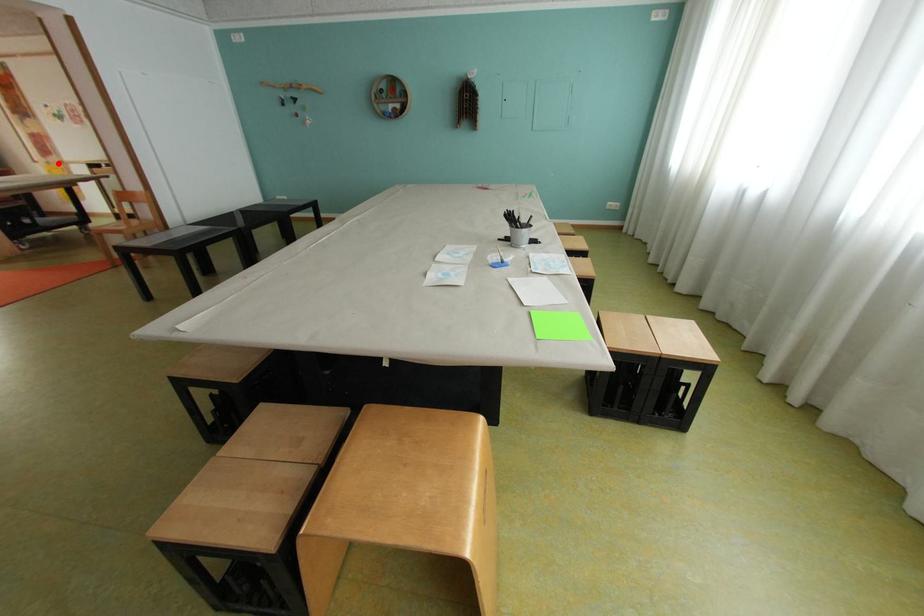
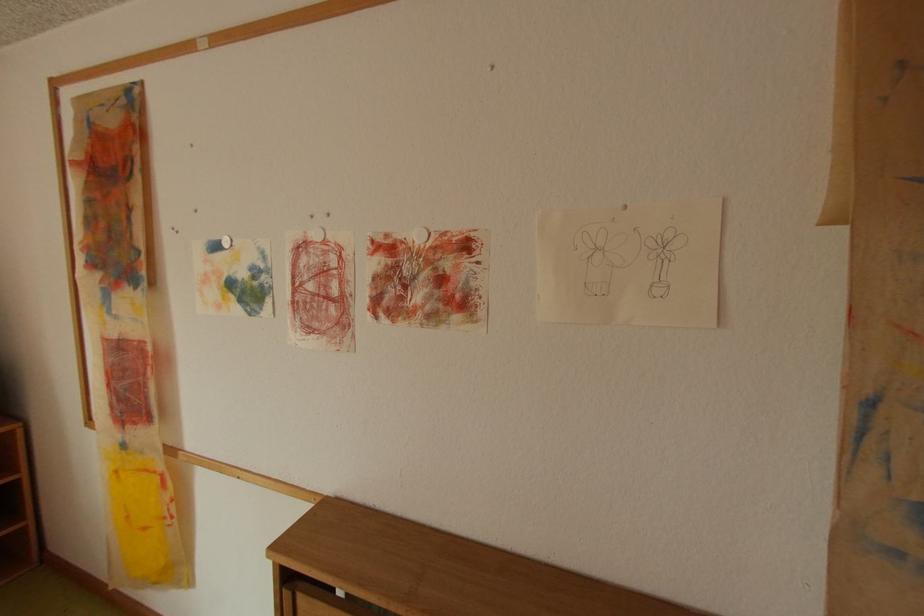
Where in the second image is the point corresponding to the highlighted location from the first image?

(134, 446)